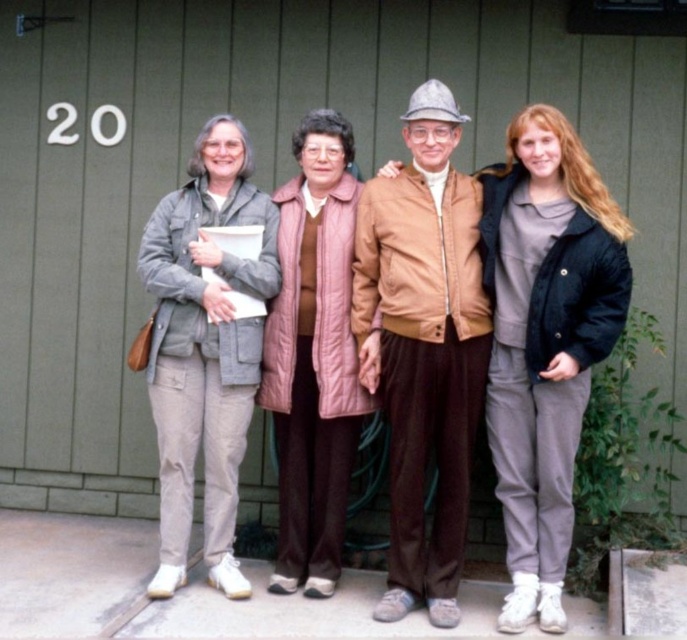
Question: Estimate the real-world distances between objects in this image. Which object is closer to the matte gray sweatshirt at center?

Choices:
 (A) tan leather jacket at center
 (B) matte gray jacket at center
 (C) light gray fabric pants at left
 (D) pink quilted vest at center

Answer: (B)

Question: Among these objects, which one is farthest from the camera?

Choices:
 (A) matte gray sweatshirt at center
 (B) tan leather jacket at center
 (C) pink quilted vest at center

Answer: (C)

Question: Can you confirm if matte gray sweatshirt at center is positioned below tan leather jacket at center?

Choices:
 (A) no
 (B) yes

Answer: (B)

Question: Which object appears closest to the camera in this image?

Choices:
 (A) matte gray jacket at center
 (B) tan leather jacket at center
 (C) matte gray sweatshirt at center
 (D) pink quilted vest at center

Answer: (A)

Question: Is matte gray jacket at center to the left of tan leather jacket at center from the viewer's perspective?

Choices:
 (A) no
 (B) yes

Answer: (A)

Question: Is matte gray jacket at center positioned behind light gray fabric pants at left?

Choices:
 (A) yes
 (B) no

Answer: (B)